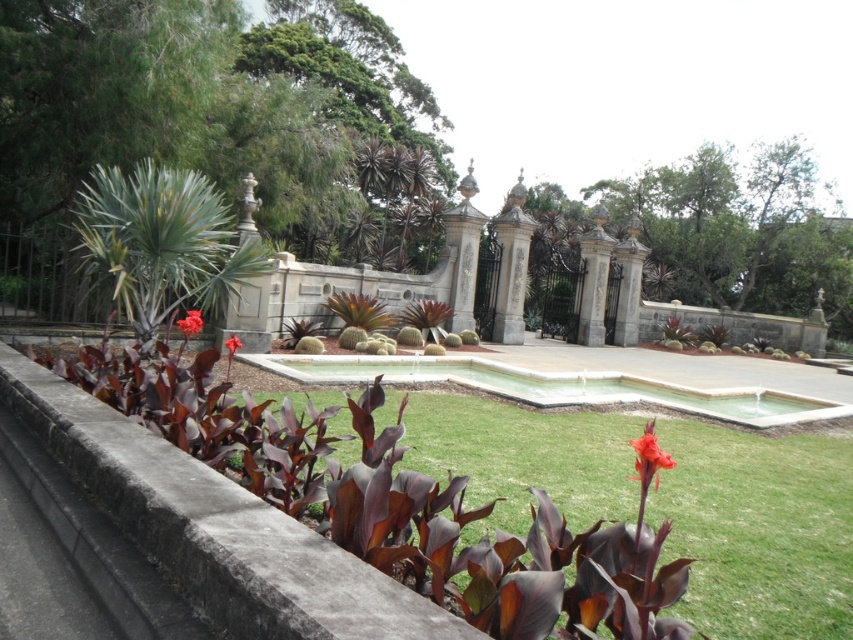
Question: Is gray concrete ledge at lower left below white concrete pool at center?

Choices:
 (A) yes
 (B) no

Answer: (B)

Question: Is green grass at center bigger than matte red flower at center?

Choices:
 (A) yes
 (B) no

Answer: (B)

Question: Which point is farther from the camera taking this photo?

Choices:
 (A) (700, 412)
 (B) (184, 330)
 (C) (231, 518)

Answer: (A)

Question: Which of the following is the farthest from the observer?

Choices:
 (A) (573, 392)
 (B) (229, 339)
 (C) (190, 326)
 (D) (357, 566)

Answer: (A)

Question: Which point is closer to the camera taking this photo?

Choices:
 (A) (259, 531)
 (B) (848, 545)
 (C) (227, 342)
 (D) (656, 460)

Answer: (D)

Question: Is green grass at center closer to camera compared to white concrete pool at center?

Choices:
 (A) yes
 (B) no

Answer: (A)